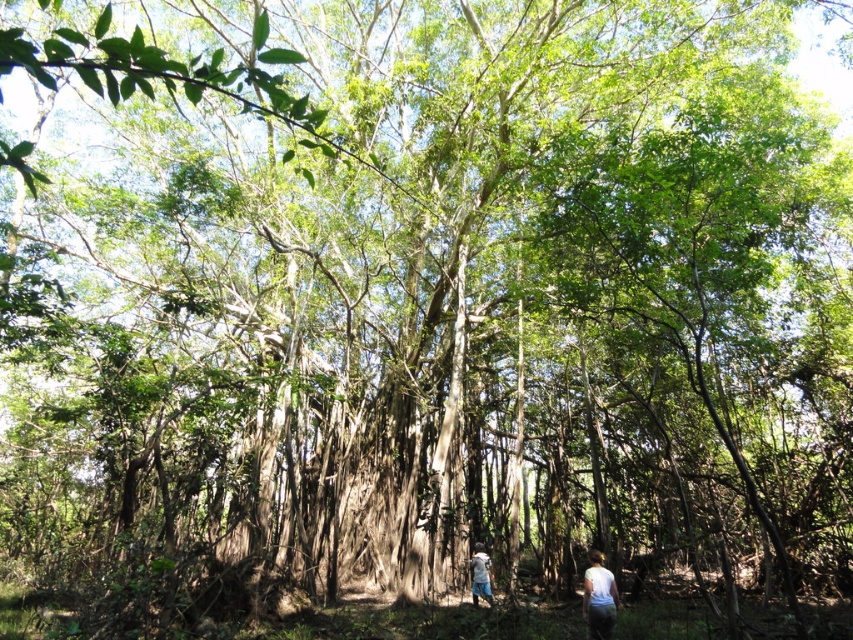
Which is more to the left, white matte shirt at lower right or white cotton shirt at lower center?

Positioned to the left is white cotton shirt at lower center.

Image resolution: width=853 pixels, height=640 pixels. In order to click on white matte shirt at lower right in this screenshot , I will do `click(599, 596)`.

Is point (589, 582) positioned after point (477, 604)?

That is False.

Where is `white matte shirt at lower right`? This screenshot has width=853, height=640. white matte shirt at lower right is located at coordinates (599, 596).